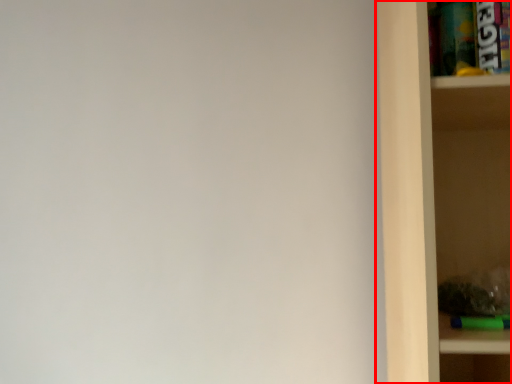
Question: From the image, what is the correct spatial relationship of shelf (annotated by the red box) in relation to cabinet?

Choices:
 (A) left
 (B) right

Answer: (B)